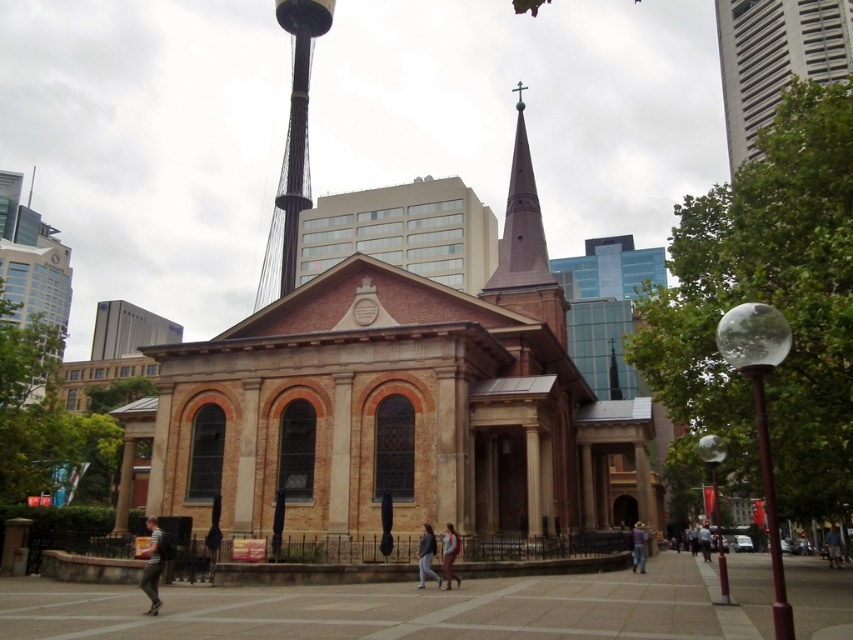
Question: Is brown wooden spire at center thinner than metallic pole at right?

Choices:
 (A) yes
 (B) no

Answer: (A)

Question: Which point is farther from the camera taking this photo?

Choices:
 (A) (450, 557)
 (B) (785, 604)

Answer: (A)

Question: Based on their relative distances, which object is farther from the black glass tower at upper center?

Choices:
 (A) light brown leather jacket at center
 (B) transparent glass lamp post at lower right
 (C) smooth brown spire at center
 (D) white glass tower at upper right

Answer: (C)

Question: Does brown leather jacket at lower center appear under smooth brown spire at center?

Choices:
 (A) no
 (B) yes

Answer: (B)

Question: Among these points, which one is farthest from the camera?

Choices:
 (A) (839, 22)
 (B) (155, 561)

Answer: (A)

Question: Can you confirm if brown wooden spire at center is wider than blue denim jeans at lower right?

Choices:
 (A) no
 (B) yes

Answer: (B)